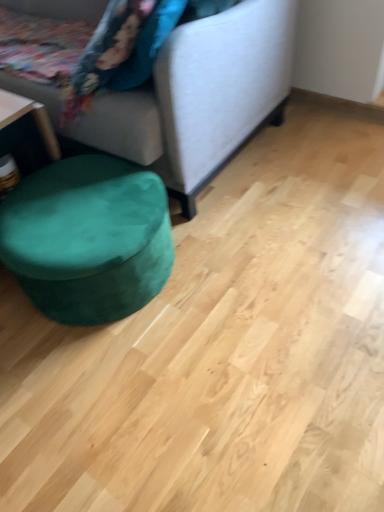
What is the approximate height of velvet green ottoman at lower left?

velvet green ottoman at lower left is 12.27 inches tall.

This screenshot has width=384, height=512. I want to click on velvet green ottoman at lower left, so click(88, 239).

This screenshot has height=512, width=384. Describe the element at coordinates (88, 239) in the screenshot. I see `velvet green ottoman at lower left` at that location.

Measure the distance between velvet fabric studio couch at lower left and camera.

The depth of velvet fabric studio couch at lower left is 3.92 feet.

This screenshot has height=512, width=384. I want to click on velvet fabric studio couch at lower left, so click(200, 97).

Consider the image. In order to face velvet fabric studio couch at lower left, should I rotate leftwards or rightwards?

It's best to rotate left around 18.565 degrees.

Image resolution: width=384 pixels, height=512 pixels. What do you see at coordinates (200, 97) in the screenshot?
I see `velvet fabric studio couch at lower left` at bounding box center [200, 97].

Locate an element on the screen. The image size is (384, 512). velvet green ottoman at lower left is located at coordinates (88, 239).

Would you say velvet fabric studio couch at lower left is to the left or to the right of velvet green ottoman at lower left in the picture?

From the image, it's evident that velvet fabric studio couch at lower left is to the left of velvet green ottoman at lower left.

Is velvet fabric studio couch at lower left in front of velvet green ottoman at lower left?

Yes, it is.

Is point (212, 125) less distant than point (37, 301)?

No, (212, 125) is further to viewer.

From the image's perspective, is velvet fabric studio couch at lower left beneath velvet green ottoman at lower left?

Incorrect, from the image's perspective, velvet fabric studio couch at lower left is higher than velvet green ottoman at lower left.

From a real-world perspective, is velvet fabric studio couch at lower left under velvet green ottoman at lower left?

Incorrect, from a real-world perspective, velvet fabric studio couch at lower left is higher than velvet green ottoman at lower left.

Does velvet fabric studio couch at lower left have a lesser width compared to velvet green ottoman at lower left?

In fact, velvet fabric studio couch at lower left might be wider than velvet green ottoman at lower left.

Considering the relative sizes of velvet fabric studio couch at lower left and velvet green ottoman at lower left in the image provided, is velvet fabric studio couch at lower left shorter than velvet green ottoman at lower left?

No, velvet fabric studio couch at lower left is not shorter than velvet green ottoman at lower left.

Considering the relative sizes of velvet fabric studio couch at lower left and velvet green ottoman at lower left in the image provided, is velvet fabric studio couch at lower left bigger than velvet green ottoman at lower left?

Correct, velvet fabric studio couch at lower left is larger in size than velvet green ottoman at lower left.

Is velvet fabric studio couch at lower left completely or partially outside of velvet green ottoman at lower left?

Indeed, velvet fabric studio couch at lower left is completely outside velvet green ottoman at lower left.

Is velvet fabric studio couch at lower left far from velvet green ottoman at lower left?

That's not correct — velvet fabric studio couch at lower left is a little close to velvet green ottoman at lower left.

Is velvet fabric studio couch at lower left oriented towards velvet green ottoman at lower left?

Yes.

How different are the orientations of velvet fabric studio couch at lower left and velvet green ottoman at lower left in degrees?

The angular difference between velvet fabric studio couch at lower left and velvet green ottoman at lower left is 0.825 degrees.

At what (x,y) coordinates should I click in order to perform the action: click on music stool on the right of velvet fabric studio couch at lower left. Please return your answer as a coordinate pair (x, y). This screenshot has width=384, height=512. Looking at the image, I should click on (88, 239).

Which is more to the left, velvet green ottoman at lower left or velvet fabric studio couch at lower left?

From the viewer's perspective, velvet fabric studio couch at lower left appears more on the left side.

Who is more distant, velvet green ottoman at lower left or velvet fabric studio couch at lower left?

velvet green ottoman at lower left is more distant.

Is point (66, 204) positioned before point (25, 90)?

Yes, it is.

From the image's perspective, between velvet green ottoman at lower left and velvet fabric studio couch at lower left, who is located below?

velvet green ottoman at lower left.

From a real-world perspective, is velvet green ottoman at lower left positioned over velvet fabric studio couch at lower left based on gravity?

No.

Considering the sizes of objects velvet green ottoman at lower left and velvet fabric studio couch at lower left in the image provided, who is wider, velvet green ottoman at lower left or velvet fabric studio couch at lower left?

With larger width is velvet fabric studio couch at lower left.

Considering the relative sizes of velvet green ottoman at lower left and velvet fabric studio couch at lower left in the image provided, is velvet green ottoman at lower left taller than velvet fabric studio couch at lower left?

No.

Between velvet green ottoman at lower left and velvet fabric studio couch at lower left, which one has smaller size?

With smaller size is velvet green ottoman at lower left.

In the scene shown: Is velvet green ottoman at lower left completely or partially outside of velvet fabric studio couch at lower left?

Absolutely, velvet green ottoman at lower left is external to velvet fabric studio couch at lower left.

Is velvet green ottoman at lower left not near velvet fabric studio couch at lower left?

velvet green ottoman at lower left is actually quite close to velvet fabric studio couch at lower left.

Is velvet green ottoman at lower left oriented towards velvet fabric studio couch at lower left?

No.

At what (x,y) coordinates should I click in order to perform the action: click on studio couch that appears in front of the velvet green ottoman at lower left. Please return your answer as a coordinate pair (x, y). This screenshot has width=384, height=512. Looking at the image, I should click on (200, 97).

The image size is (384, 512). I want to click on music stool on the right of velvet fabric studio couch at lower left, so pyautogui.click(x=88, y=239).

The width and height of the screenshot is (384, 512). What are the coordinates of `music stool beneath the velvet fabric studio couch at lower left (from a real-world perspective)` in the screenshot? It's located at [x=88, y=239].